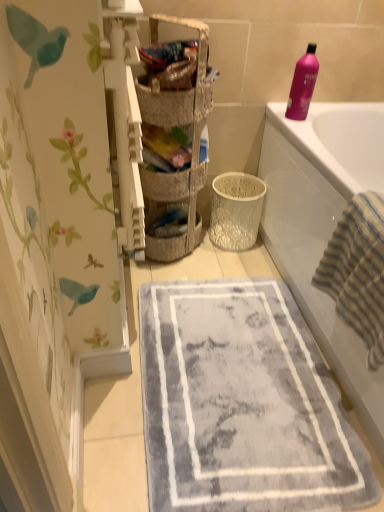
Image resolution: width=384 pixels, height=512 pixels. Identify the location of vacant area on top of gray plush bath mat at center (from a real-world perspective). (247, 372).